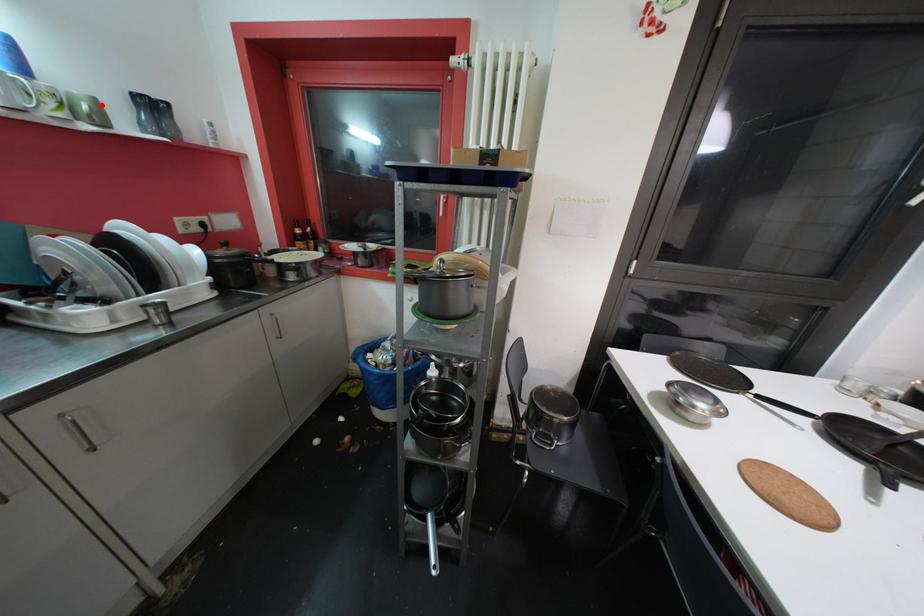
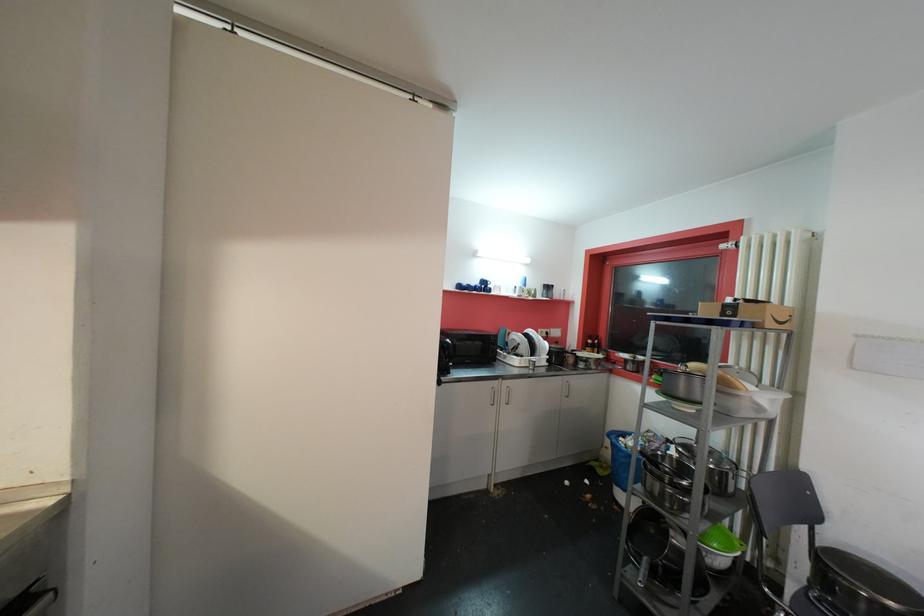
The point at the highlighted location is marked in the first image. Where is the corresponding point in the second image?

(541, 293)